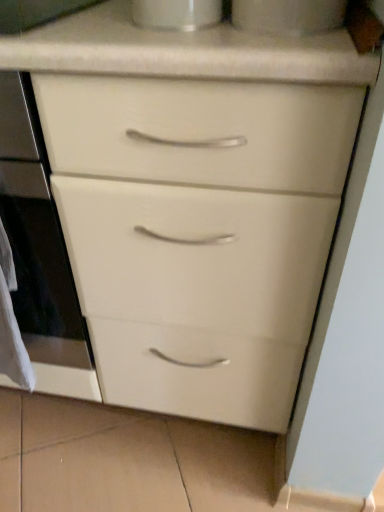
What is the approximate width of white glossy cup at upper center, marked as the second appliance in a right-to-left arrangement?

white glossy cup at upper center, marked as the second appliance in a right-to-left arrangement, is 18.85 centimeters in width.

The width and height of the screenshot is (384, 512). What are the coordinates of `white paper at left` in the screenshot? It's located at (11, 323).

In order to click on white glossy cup at upper center, the second appliance viewed from the left in this screenshot , I will do `click(288, 16)`.

Which object is closer to the camera taking this photo, white paper at left or white glossy cup at upper center, the second appliance viewed from the left?

white glossy cup at upper center, the second appliance viewed from the left, is closer to the camera.

Can you confirm if white paper at left is wider than white glossy cup at upper center, arranged as the 1th appliance when viewed from the right?

In fact, white paper at left might be narrower than white glossy cup at upper center, arranged as the 1th appliance when viewed from the right.

Is white paper at left turned away from white glossy cup at upper center, the second appliance viewed from the left?

No, white paper at left's orientation is not away from white glossy cup at upper center, the second appliance viewed from the left.

Is white glossy cup at upper center, the second appliance viewed from the left, facing away from white paper at left?

white glossy cup at upper center, the second appliance viewed from the left, does not have its back to white paper at left.

Can you tell me how much white glossy cup at upper center, the second appliance viewed from the left, and white paper at left differ in facing direction?

1.98 degrees separate the facing orientations of white glossy cup at upper center, the second appliance viewed from the left, and white paper at left.

Is white glossy cup at upper center, the second appliance viewed from the left, taller or shorter than white paper at left?

In the image, white glossy cup at upper center, the second appliance viewed from the left, appears to be shorter than white paper at left.

Is white glossy cup at upper center, the second appliance viewed from the left, completely or partially inside white glossy oven at center?

No, white glossy cup at upper center, the second appliance viewed from the left, is not inside white glossy oven at center.

Could you measure the distance between white glossy oven at center and white glossy cup at upper center, the second appliance viewed from the left?

white glossy oven at center and white glossy cup at upper center, the second appliance viewed from the left, are 19.40 inches apart from each other.

Is white glossy oven at center smaller than white glossy cup at upper center, the second appliance viewed from the left?

No, white glossy oven at center is not smaller than white glossy cup at upper center, the second appliance viewed from the left.

From the image's perspective, is white glossy oven at center located above or below white glossy cup at upper center, the second appliance viewed from the left?

Clearly, from the image's perspective, white glossy oven at center is below white glossy cup at upper center, the second appliance viewed from the left.

Is white glossy cup at upper center, marked as the second appliance in a right-to-left arrangement, placed right next to white glossy oven at center?

white glossy cup at upper center, marked as the second appliance in a right-to-left arrangement, is not next to white glossy oven at center, and they're not touching.

Based on the photo, is white glossy cup at upper center, which appears as the 1th appliance when viewed from the left, thinner than white glossy oven at center?

Correct, the width of white glossy cup at upper center, which appears as the 1th appliance when viewed from the left, is less than that of white glossy oven at center.

Does white glossy cup at upper center, which appears as the 1th appliance when viewed from the left, appear on the left side of white glossy oven at center?

No, white glossy cup at upper center, which appears as the 1th appliance when viewed from the left, is not to the left of white glossy oven at center.

Based on the photo, which point is more forward, (210, 25) or (15, 98)?

Point (210, 25)

Which object is wider, white glossy oven at center or white glossy cup at upper center, which appears as the 1th appliance when viewed from the left?

white glossy oven at center.

Does white glossy oven at center have a greater height compared to white glossy cup at upper center, which appears as the 1th appliance when viewed from the left?

Indeed, white glossy oven at center has a greater height compared to white glossy cup at upper center, which appears as the 1th appliance when viewed from the left.

Does white glossy oven at center have a smaller size compared to white glossy cup at upper center, which appears as the 1th appliance when viewed from the left?

No.

Can you tell me how much white glossy oven at center and white glossy cup at upper center, which appears as the 1th appliance when viewed from the left, differ in facing direction?

The angle between the facing direction of white glossy oven at center and the facing direction of white glossy cup at upper center, which appears as the 1th appliance when viewed from the left, is 0.733 degrees.

Between white paper at left and white glossy cup at upper center, which appears as the 1th appliance when viewed from the left, which one appears on the left side from the viewer's perspective?

From the viewer's perspective, white paper at left appears more on the left side.

How many degrees apart are the facing directions of white paper at left and white glossy cup at upper center, which appears as the 1th appliance when viewed from the left?

white paper at left and white glossy cup at upper center, which appears as the 1th appliance when viewed from the left, are facing 1.98 degrees away from each other.

Is white paper at left positioned beyond the bounds of white glossy cup at upper center, marked as the second appliance in a right-to-left arrangement?

That's correct, white paper at left is outside of white glossy cup at upper center, marked as the second appliance in a right-to-left arrangement.

Considering the positions of points (44, 207) and (6, 310), is point (44, 207) farther from camera compared to point (6, 310)?

No, (44, 207) is in front of (6, 310).

Does white glossy oven at center have a greater height compared to white paper at left?

Yes, white glossy oven at center is taller than white paper at left.

Can you confirm if white glossy oven at center is thinner than white paper at left?

No, white glossy oven at center is not thinner than white paper at left.

In the image, there is a white glossy cup at upper center, arranged as the 1th appliance when viewed from the right. Identify the location of material below it (from a real-world perspective). (11, 323).

Find the location of a particular element. the 2nd appliance above the white paper at left (from the image's perspective) is located at coordinates (288, 16).

From the image, which object appears to be nearer to white glossy cup at upper center, the second appliance viewed from the left, white paper at left or white glossy oven at center?

white glossy oven at center lies closer to white glossy cup at upper center, the second appliance viewed from the left, than the other object.

Based on their spatial positions, is white glossy oven at center or white glossy cup at upper center, the second appliance viewed from the left, closer to white glossy cup at upper center, which appears as the 1th appliance when viewed from the left?

white glossy cup at upper center, the second appliance viewed from the left, is closer to white glossy cup at upper center, which appears as the 1th appliance when viewed from the left.

Looking at this image, which object lies further to the anchor point white paper at left, white glossy oven at center or white glossy cup at upper center, the second appliance viewed from the left?

white glossy cup at upper center, the second appliance viewed from the left, lies further to white paper at left than the other object.

In the scene shown: Looking at the image, which one is located closer to white glossy oven at center, white paper at left or white glossy cup at upper center, which appears as the 1th appliance when viewed from the left?

white paper at left lies closer to white glossy oven at center than the other object.

Considering their positions, is white paper at left positioned further to white glossy cup at upper center, which appears as the 1th appliance when viewed from the left, than white glossy cup at upper center, the second appliance viewed from the left?

white paper at left lies further to white glossy cup at upper center, which appears as the 1th appliance when viewed from the left, than the other object.

Estimate the real-world distances between objects in this image. Which object is further from white paper at left, white glossy cup at upper center, the second appliance viewed from the left, or white glossy cup at upper center, marked as the second appliance in a right-to-left arrangement?

white glossy cup at upper center, the second appliance viewed from the left, is further to white paper at left.

Which object lies further to the anchor point white paper at left, white glossy cup at upper center, the second appliance viewed from the left, or white glossy oven at center?

Based on the image, white glossy cup at upper center, the second appliance viewed from the left, appears to be further to white paper at left.

Looking at the image, which one is located closer to white glossy cup at upper center, which appears as the 1th appliance when viewed from the left, white glossy cup at upper center, the second appliance viewed from the left, or white paper at left?

white glossy cup at upper center, the second appliance viewed from the left, lies closer to white glossy cup at upper center, which appears as the 1th appliance when viewed from the left, than the other object.

Where is `material situated between white glossy oven at center and white glossy cup at upper center, arranged as the 1th appliance when viewed from the right, from left to right`? material situated between white glossy oven at center and white glossy cup at upper center, arranged as the 1th appliance when viewed from the right, from left to right is located at coordinates (11, 323).

At what (x,y) coordinates should I click in order to perform the action: click on oven between white glossy cup at upper center, which appears as the 1th appliance when viewed from the left, and white paper at left from top to bottom. Please return your answer as a coordinate pair (x, y). Looking at the image, I should click on (43, 244).

At what (x,y) coordinates should I click in order to perform the action: click on appliance between white glossy oven at center and white glossy cup at upper center, the second appliance viewed from the left. Please return your answer as a coordinate pair (x, y). The width and height of the screenshot is (384, 512). Looking at the image, I should click on coord(177,14).

At what (x,y) coordinates should I click in order to perform the action: click on appliance between white glossy cup at upper center, the second appliance viewed from the left, and white paper at left from top to bottom. Please return your answer as a coordinate pair (x, y). Looking at the image, I should click on (177, 14).